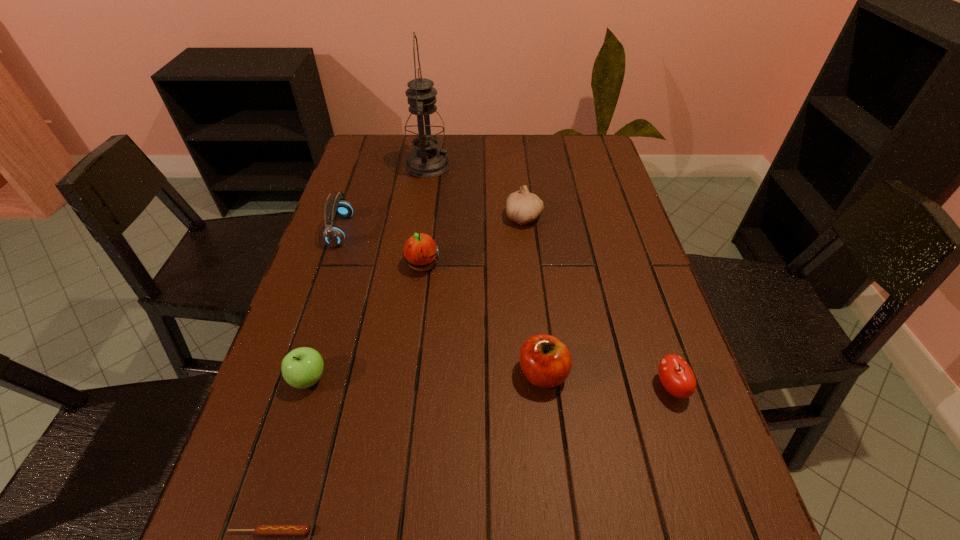
You are a GUI agent. You are given a task and a screenshot of the screen. Output one action in this format:
    pyautogui.click(x=<x>, y=<y>)
    Task: Click on the farthest object
    
    Given the screenshot: What is the action you would take?
    pyautogui.click(x=424, y=128)

Identify the location of oil lamp. (424, 128).

Where is `headset`? The height and width of the screenshot is (540, 960). headset is located at coordinates (338, 206).

Identify the location of garlic. Image resolution: width=960 pixels, height=540 pixels. (523, 207).

Where is `the second apple from right to left`? This screenshot has height=540, width=960. the second apple from right to left is located at coordinates (545, 361).

Locate an element on the screen. the farthest apple is located at coordinates (420, 251).

Find the location of a particular element. This screenshot has width=960, height=540. the fourth farthest object is located at coordinates (420, 251).

The image size is (960, 540). Identify the location of the rightmost object. (676, 376).

Image resolution: width=960 pixels, height=540 pixels. What are the coordinates of `the leftmost apple` in the screenshot? It's located at (301, 368).

Where is `sausage`? sausage is located at coordinates (263, 529).